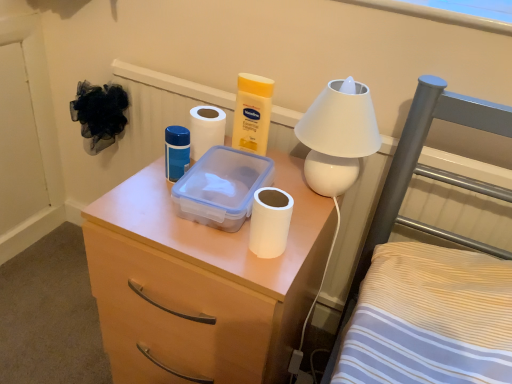
What are the coordinates of `vacant space behind white matte toilet paper at center, the 2th toilet paper from the back` in the screenshot? It's located at (301, 206).